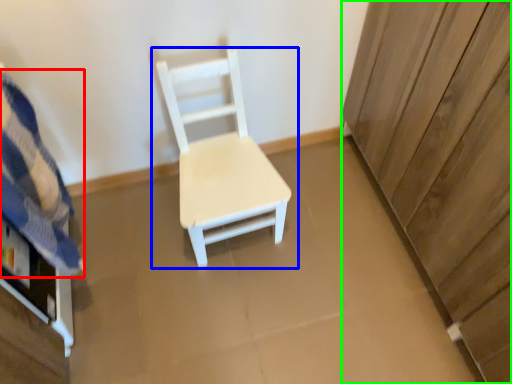
Question: Based on their relative distances, which object is nearer to bedding (highlighted by a red box)? Choose from chair (highlighted by a blue box) and dresser (highlighted by a green box).

Choices:
 (A) chair
 (B) dresser

Answer: (A)